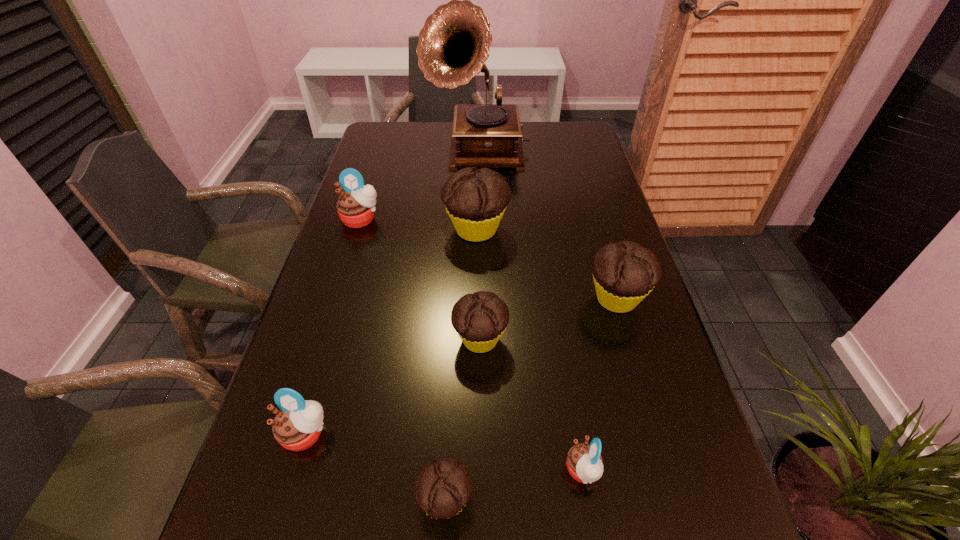
You are a GUI agent. You are given a task and a screenshot of the screen. Output one action in this format:
    pyautogui.click(x=<x>, y=<y>)
    Task: Click on the empty space that is in between the rightmost pink muffin and the third biggest chocolate muffin
    
    Given the screenshot: What is the action you would take?
    pyautogui.click(x=532, y=405)

Find the location of a particular element. This screenshot has height=540, width=960. free spot between the third biggest chocolate muffin and the record player is located at coordinates (479, 246).

This screenshot has width=960, height=540. What are the coordinates of `free space between the second biggest pink muffin and the rightmost muffin` in the screenshot? It's located at (461, 366).

This screenshot has width=960, height=540. What are the coordinates of `vacant area between the farthest chocolate muffin and the biggest pink muffin` in the screenshot? It's located at (419, 225).

This screenshot has width=960, height=540. What are the coordinates of `empty space between the second smallest chocolate muffin and the sixth muffin from left to right` in the screenshot? It's located at (532, 405).

You are a GUI agent. You are given a task and a screenshot of the screen. Output one action in this format:
    pyautogui.click(x=<x>, y=<y>)
    Task: Click on the free space between the biggest pink muffin and the tallest object
    
    Given the screenshot: What is the action you would take?
    pyautogui.click(x=420, y=187)

Where is `object that is the sixth closest one to the rightmost muffin`? The image size is (960, 540). object that is the sixth closest one to the rightmost muffin is located at coordinates (355, 207).

I want to click on object that stands as the sixth closest to the brown record player, so click(584, 462).

Find the location of a particular element. The image size is (960, 540). muffin identified as the fifth closest to the biggest pink muffin is located at coordinates (442, 488).

The image size is (960, 540). I want to click on the third closest muffin to the second smallest pink muffin, so click(584, 462).